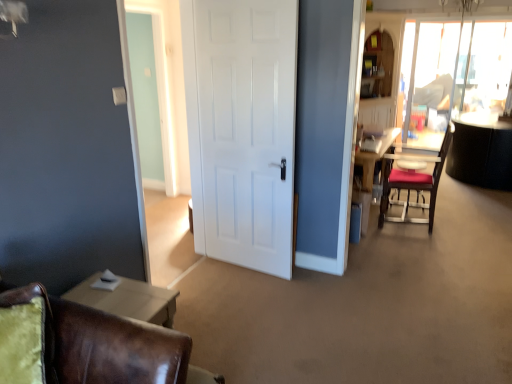
This screenshot has width=512, height=384. What are the coordinates of `vacant area to the right of velvet red chair at right, positioned as the first chair in top-to-bottom order` in the screenshot? It's located at (460, 225).